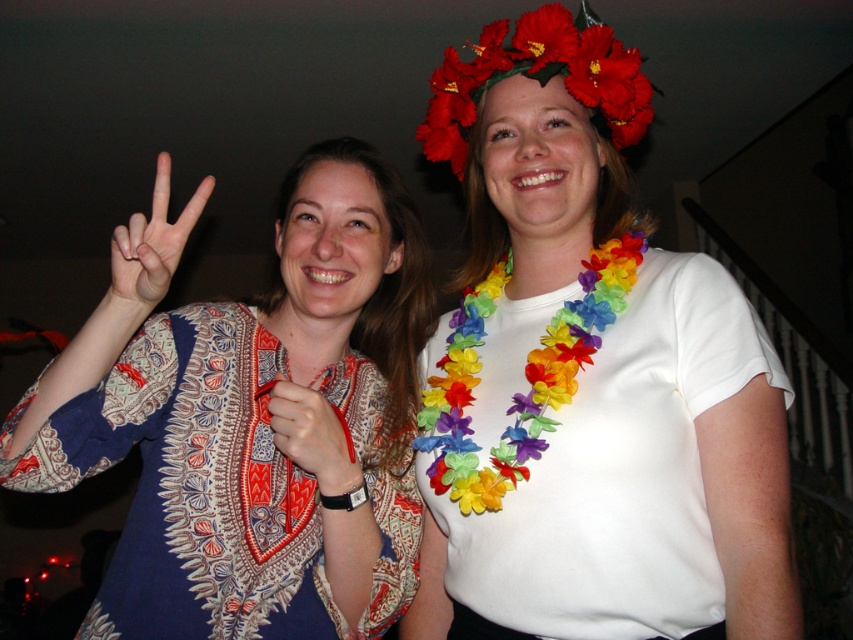
Question: Is the position of floral crown at upper center less distant than that of matte fabric hand at center?

Choices:
 (A) yes
 (B) no

Answer: (B)

Question: Which object appears closest to the camera in this image?

Choices:
 (A) matte fabric hand at center
 (B) rainbow fabric lei at center
 (C) floral crown at upper center

Answer: (B)

Question: Does matte white hand at center appear over matte fabric hand at center?

Choices:
 (A) yes
 (B) no

Answer: (A)

Question: Which of the following is the closest to the observer?

Choices:
 (A) patterned fabric shirt at center
 (B) white fabric lei at upper right
 (C) rainbow fabric lei at center
 (D) matte fabric hand at center

Answer: (A)

Question: Can you confirm if white fabric lei at upper right is positioned to the left of floral crown at upper center?

Choices:
 (A) no
 (B) yes

Answer: (A)

Question: Which object appears closest to the camera in this image?

Choices:
 (A) white fabric lei at upper right
 (B) rainbow fabric lei at center
 (C) patterned fabric shirt at center

Answer: (C)